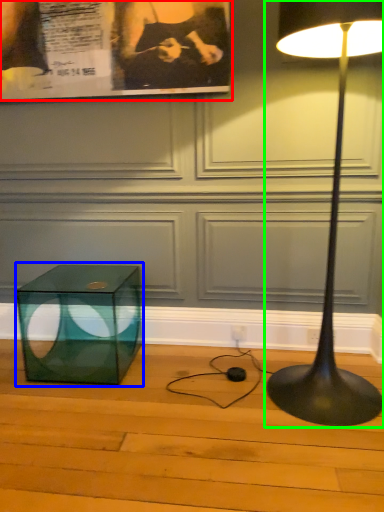
Question: Which object is the closest to the poster page (highlighted by a red box)? Choose among these: table (highlighted by a blue box) or lamp (highlighted by a green box).

Choices:
 (A) table
 (B) lamp

Answer: (B)